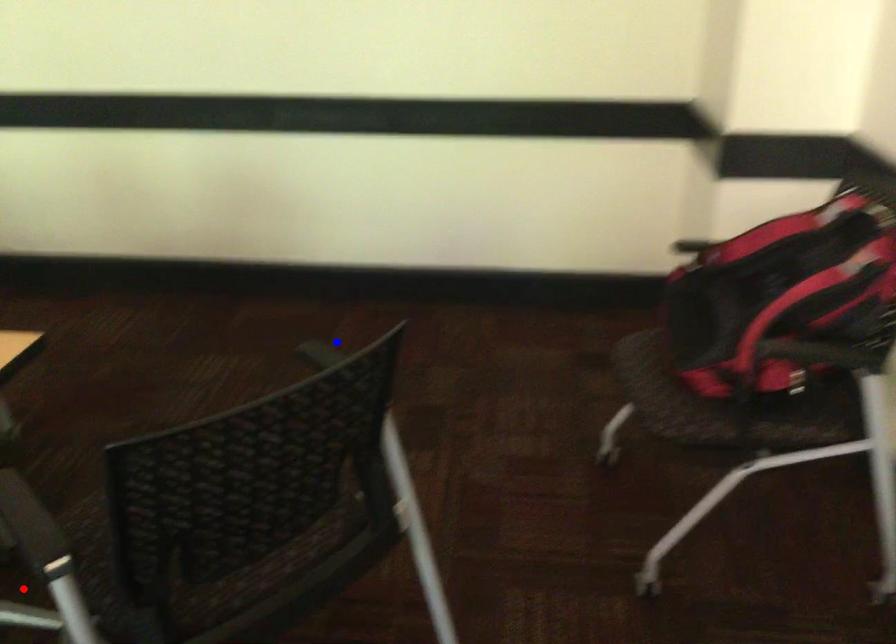
Question: Which of the two points in the image is closer to the camera?

Choices:
 (A) Blue point is closer.
 (B) Red point is closer.

Answer: (B)